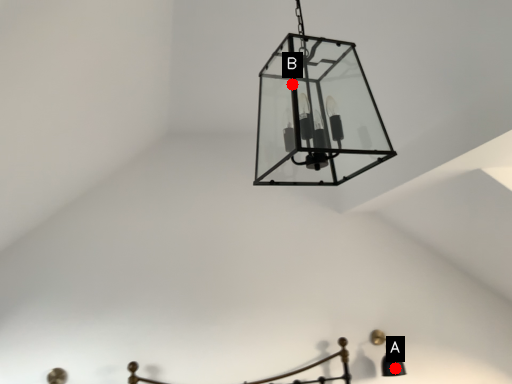
Question: Two points are circled on the image, labeled by A and B beside each circle. Among these points, which one is nearest to the camera?

Choices:
 (A) A is closer
 (B) B is closer

Answer: (B)